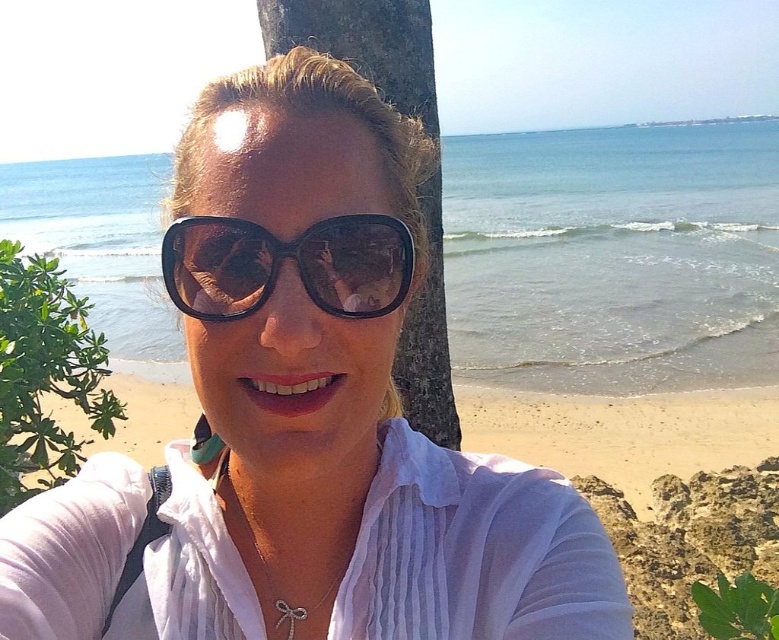
You are a photographer trying to frame a shot of the beach scene. You need to decide which object, the brown textured tree trunk at center or the green leafy bush at left, will occupy more horizontal space in your photo. Which one should you focus on?

The brown textured tree trunk at center is wider than the green leafy bush at left, so you should focus on the brown textured tree trunk at center as it occupies more horizontal space.

You are a photographer trying to capture the perfect shot of the sunglasses at center and the green leafy bush at left. Which object should you focus on first if you want to ensure both are in frame without moving the camera?

You should focus on the sunglasses at center first because it is smaller in height compared to the green leafy bush at left, allowing you to frame both effectively without needing to adjust the camera position.